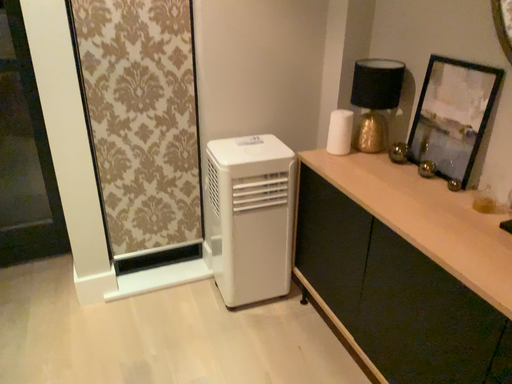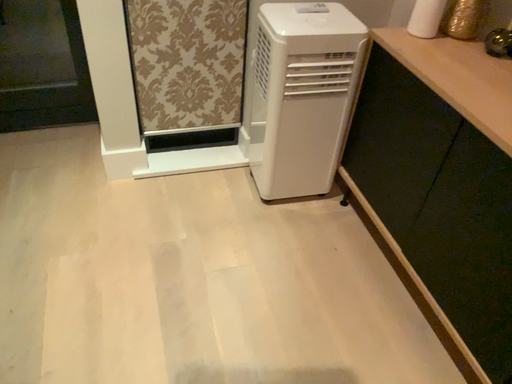
Question: How did the camera likely rotate when shooting the video?

Choices:
 (A) rotated downward
 (B) rotated upward

Answer: (A)